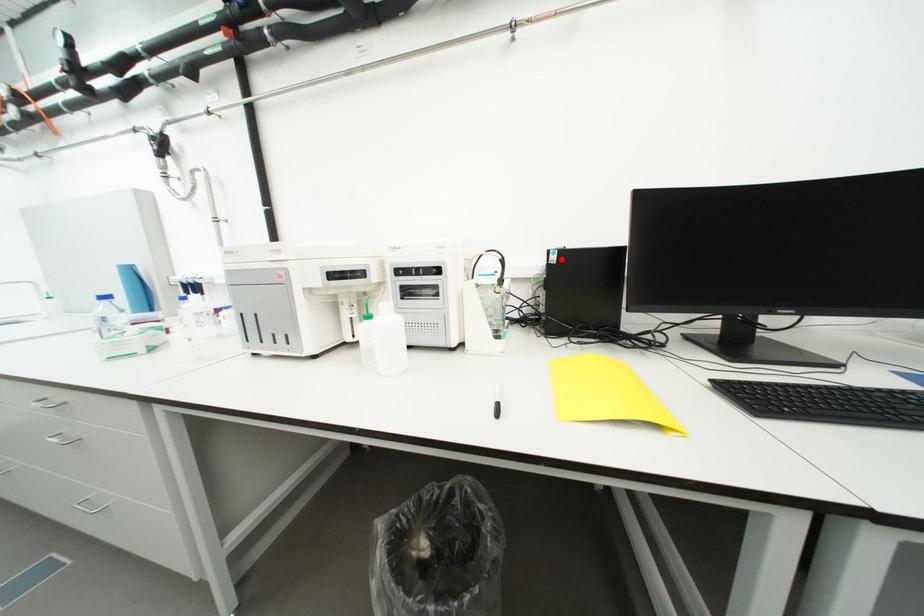
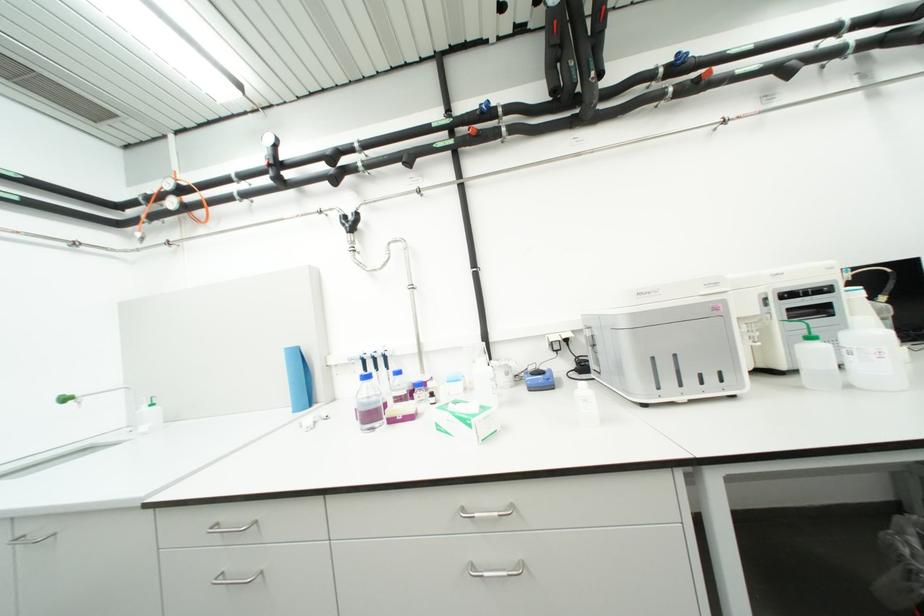
Question: I am providing you with two images of the same scene from different viewpoints. A red point is marked on the first image. Is the red point's position out of view in image 2?

Choices:
 (A) Yes
 (B) No

Answer: (A)